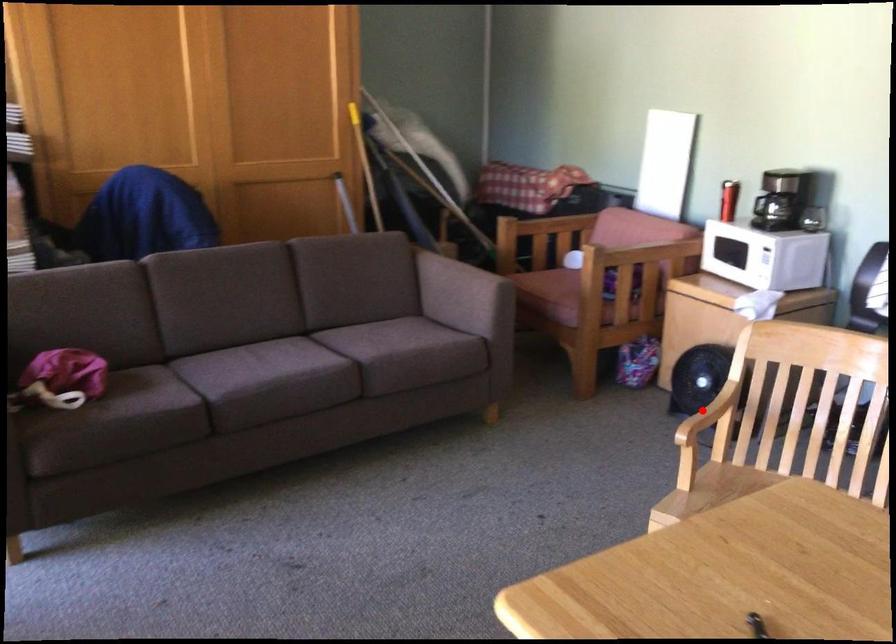
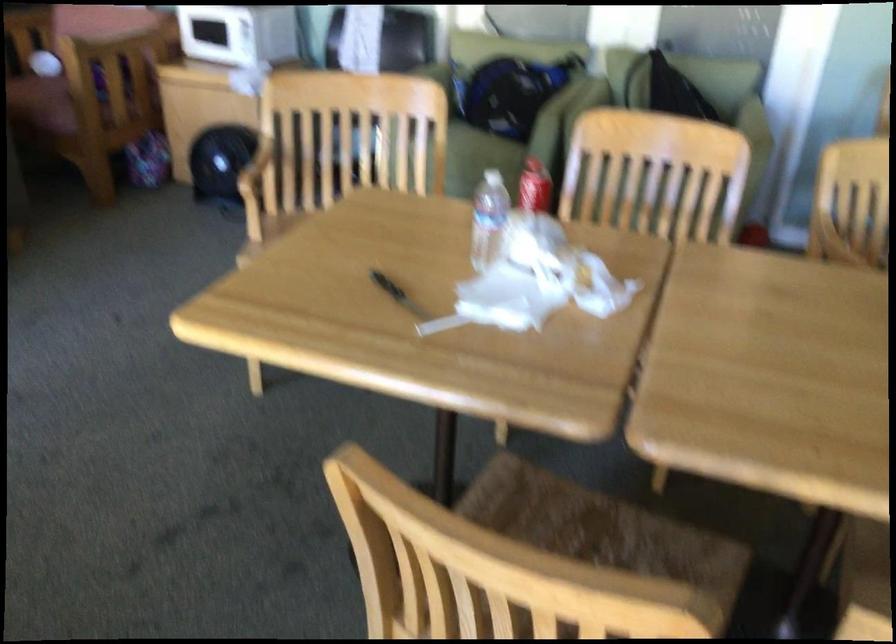
Where in the second image is the point corresponding to the highlighted location from the first image?

(255, 166)